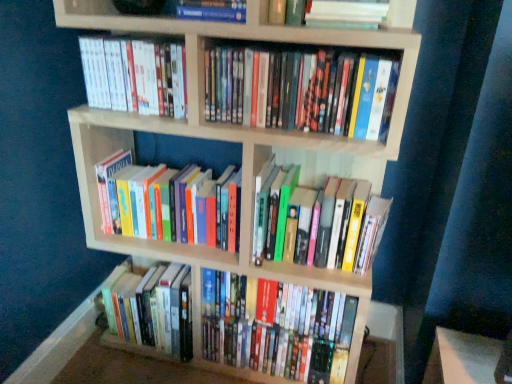
Question: Which is correct: white matte book at upper center, the second book in the top-to-bottom sequence, is inside hardcover book at center, the eighth book from the top, or outside of it?

Choices:
 (A) inside
 (B) outside

Answer: (B)

Question: Is white matte book at upper center, the 7th book from the bottom, to the left or to the right of hardcover book at center, which ranks as the first book in bottom-to-top order, in the image?

Choices:
 (A) left
 (B) right

Answer: (B)

Question: Which object is positioned closest to the hardcover book at upper center, placed as the first book when sorted from top to bottom?

Choices:
 (A) hardcover books at center, which appears as the 6th book when viewed from the top
 (B) multicolored hardcover books at upper center, which appears as the 5th book when ordered from the bottom
 (C) white matte book at upper left, positioned as the 3th book in top-to-bottom order
 (D) hardcover books at center, which is counted as the 4th book, starting from the bottom
 (E) hardcover books at lower left, which ranks as the seventh book in top-to-bottom order

Answer: (C)

Question: Which object is positioned closest to the white matte book at upper center, the 7th book from the bottom?

Choices:
 (A) white matte book at upper left, positioned as the 3th book in top-to-bottom order
 (B) hardcover books at center, acting as the 5th book starting from the top
 (C) hardcover books at lower left, which is the second book from bottom to top
 (D) hardcover books at center, which appears as the 6th book when viewed from the top
 (E) hardcover book at center, the eighth book from the top

Answer: (A)